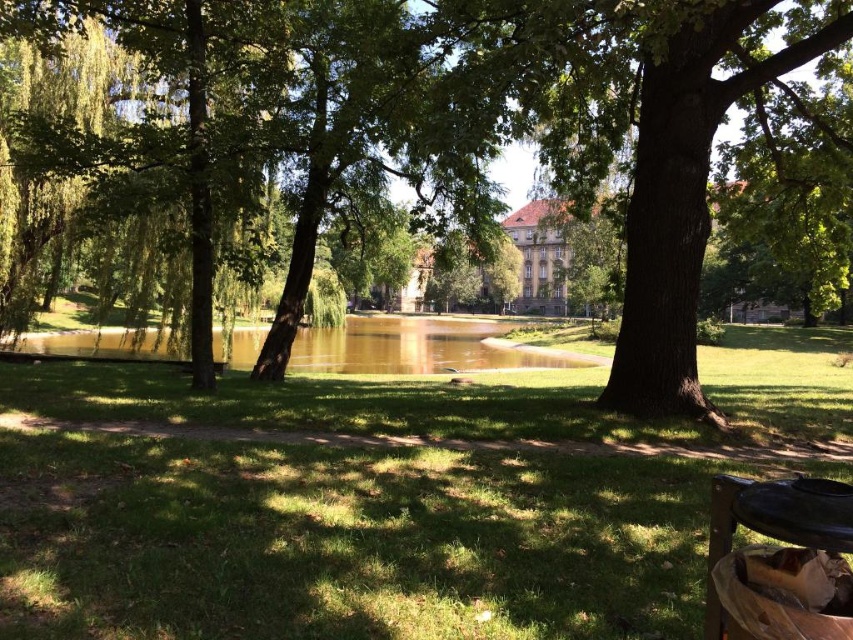
Question: Which point is farther from the camera taking this photo?

Choices:
 (A) (694, 268)
 (B) (144, 515)
 (C) (404, 360)
 (D) (717, 552)

Answer: (C)

Question: Does brown liquid water at center come in front of black wood picnic table at lower right?

Choices:
 (A) yes
 (B) no

Answer: (B)

Question: Does brown liquid water at center appear over black wood picnic table at lower right?

Choices:
 (A) yes
 (B) no

Answer: (A)

Question: Is green grass at center in front of black wood picnic table at lower right?

Choices:
 (A) yes
 (B) no

Answer: (B)

Question: Which of the following is the farthest from the observer?

Choices:
 (A) brown liquid water at center
 (B) black wood picnic table at lower right
 (C) green leafy tree at center

Answer: (A)

Question: Which point appears farthest from the camera in this image?

Choices:
 (A) (712, 525)
 (B) (553, 164)
 (C) (213, 618)
 (D) (442, 337)

Answer: (D)